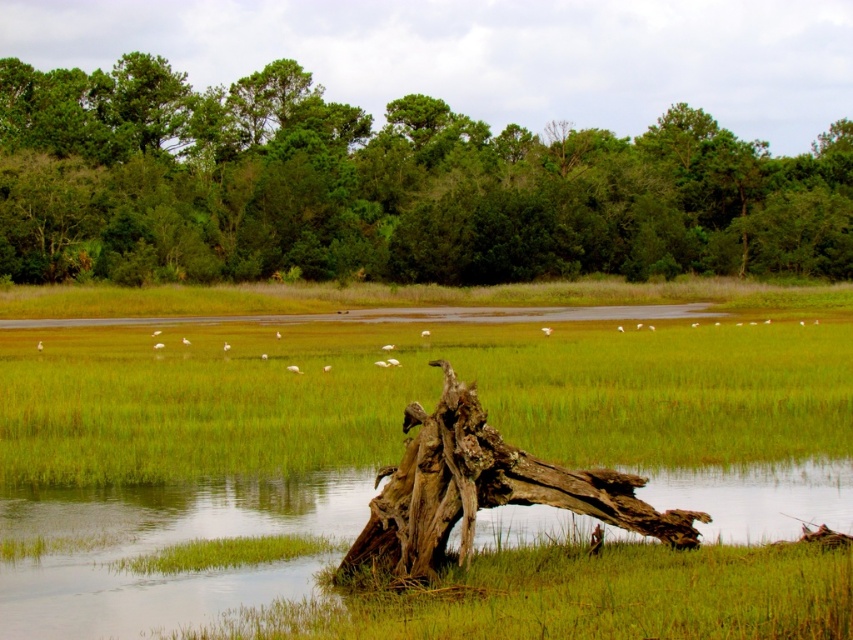
Between point (664, 122) and point (759, 396), which one is positioned in front?

Point (759, 396) is in front.

Is green leafy tree at upper center shorter than green grass at center?

In fact, green leafy tree at upper center may be taller than green grass at center.

Who is more distant from viewer, (479, 236) or (518, 424)?

Point (479, 236)

You are a GUI agent. You are given a task and a screenshot of the screen. Output one action in this format:
    pyautogui.click(x=<x>, y=<y>)
    Task: Click on the green leafy tree at upper center
    
    Given the screenshot: What is the action you would take?
    pyautogui.click(x=386, y=188)

Is green leafy tree at upper center positioned before translucent water at center?

No, green leafy tree at upper center is further to the viewer.

Between point (496, 211) and point (509, 515), which one is positioned behind?

Positioned behind is point (496, 211).

The width and height of the screenshot is (853, 640). I want to click on green leafy tree at upper center, so click(386, 188).

Is green grass at center above brown rough wood at center?

Indeed, green grass at center is positioned over brown rough wood at center.

Does point (566, 353) lie behind point (363, 541)?

Yes, point (566, 353) is farther from viewer.

Is point (170, 390) farther from camera compared to point (451, 397)?

Yes.

Find the location of `green grass at center`. green grass at center is located at coordinates (416, 394).